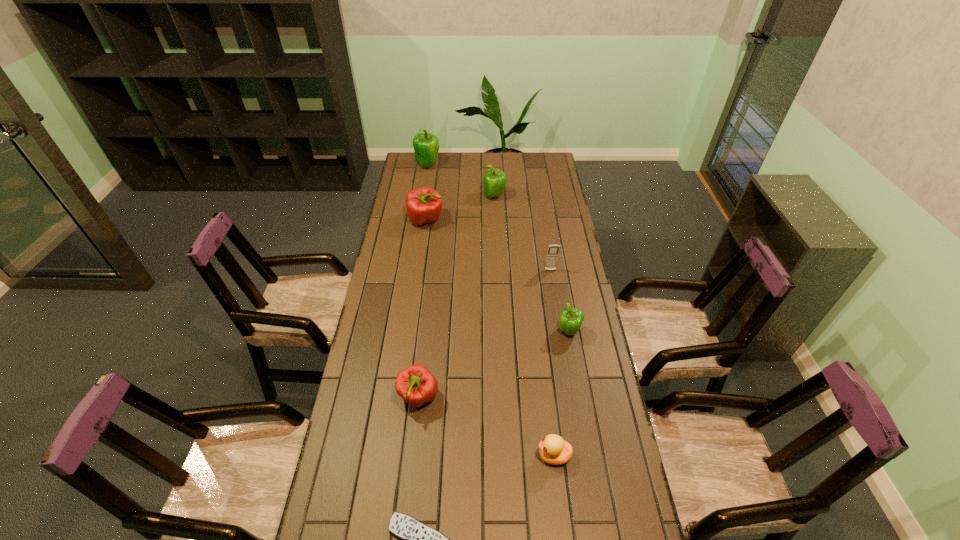
Identify which object is located as the fifth nearest to the farthest object. Please provide its 2D coordinates. Your answer should be formatted as a tuple, i.e. [(x, y)], where the tuple contains the x and y coordinates of a point satisfying the conditions above.

[(416, 384)]

The width and height of the screenshot is (960, 540). Find the location of `bell pepper that is the fourth closest to the fifth nearest object`. bell pepper that is the fourth closest to the fifth nearest object is located at coordinates (416, 384).

Where is `bell pepper that is the second nearest to the nearest bell pepper`? bell pepper that is the second nearest to the nearest bell pepper is located at coordinates (423, 205).

Identify which green bell pepper is located as the nearest to the rightmost bell pepper. Please provide its 2D coordinates. Your answer should be formatted as a tuple, i.e. [(x, y)], where the tuple contains the x and y coordinates of a point satisfying the conditions above.

[(494, 180)]

Locate which green bell pepper ranks second in proximity to the biggest green bell pepper. Please provide its 2D coordinates. Your answer should be formatted as a tuple, i.e. [(x, y)], where the tuple contains the x and y coordinates of a point satisfying the conditions above.

[(571, 318)]

You are a GUI agent. You are given a task and a screenshot of the screen. Output one action in this format:
    pyautogui.click(x=<x>, y=<y>)
    Task: Click on the blank area in the image that satisfies the following two spatial constraints: 1. on the front-facing side of the gray cellular telephone; 2. on the face of the third object from right to left
    The width and height of the screenshot is (960, 540).
    Given the screenshot: What is the action you would take?
    pyautogui.click(x=580, y=456)